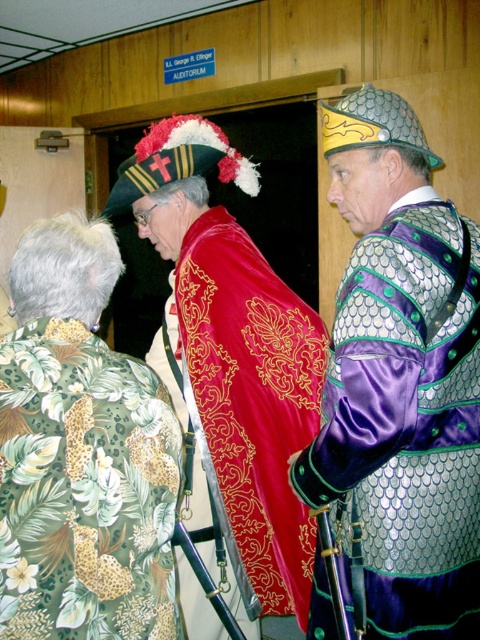
You are standing in the L.L. George R. Effinger AUDITORIUM and see the green floral shirt at lower left. What are its coordinates?

The green floral shirt at lower left is located at coordinates point (x=82, y=452).

You are standing at the entrance of the L.L. George R. Effinger AUDITORIUM and see two points marked on the floor. The first point is at coordinates point (237, 406) and the second point is at point (200, 474). If you want to walk towards the point that is closer to the entrance, which point should you head towards?

Point (237, 406) is in front of point (200, 474), so the point closer to the entrance is point (237, 406).